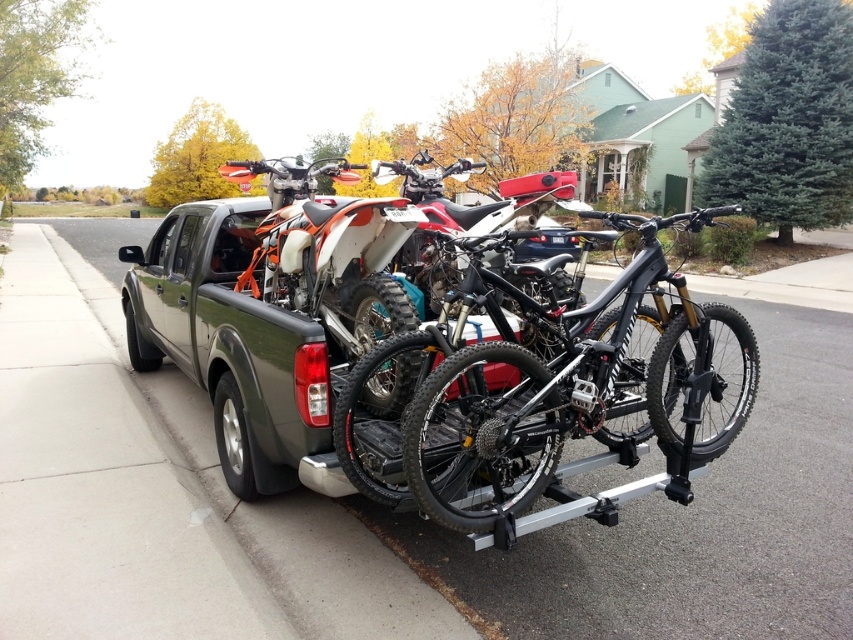
You are a delivery person who needs to load a new bike onto the truck. The truck bed already has the matte black dirt bike at center and the black matte bicycle at center. Which one would you need to adjust to make space for the new bike?

The black matte bicycle at center is not as tall as the matte black dirt bike at center, so you might need to adjust the black matte bicycle at center to make space since it is shorter and easier to reposition.

You are standing at the point with coordinates (575, 404). Looking around, you see a pickup truck parked on a residential street with motorcycles and bicycles. Which object are you currently touching?

The point at coordinates (575, 404) is on the black matte bicycle at center, so you are touching the black matte bicycle at center.

You are a delivery person who needs to unload the black matte bicycle at center and the matte black dirt bike at center from the truck. Which one should you unload first to access the other?

The black matte bicycle at center is to the left of the matte black dirt bike at center. Since it is positioned to the left, you should unload the black matte bicycle at center first to access the matte black dirt bike at center.